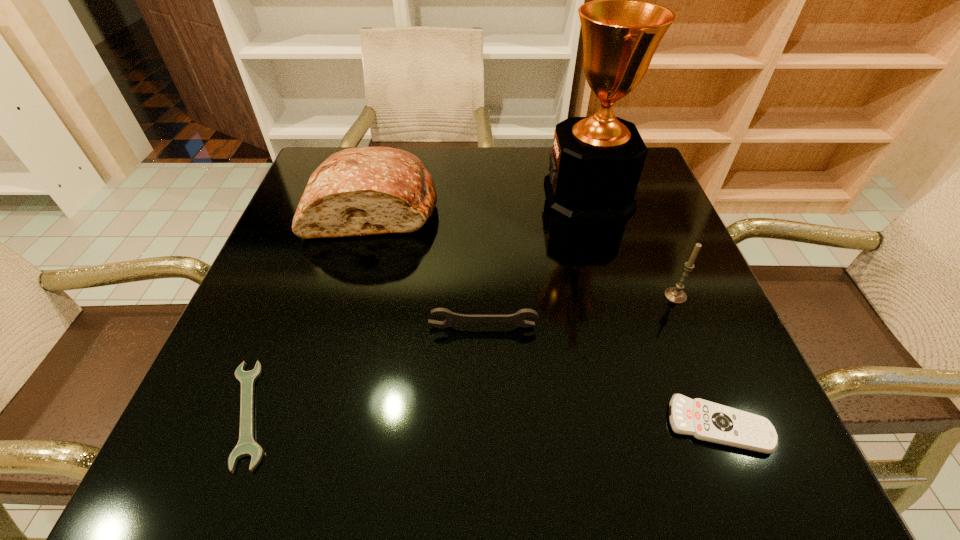
The image size is (960, 540). I want to click on vacant space at the left edge of the desktop, so click(294, 256).

Find the location of a particular element. The width and height of the screenshot is (960, 540). vacant space at the right edge of the desktop is located at coordinates (695, 355).

Locate an element on the screen. The image size is (960, 540). vacant region at the near left corner is located at coordinates (257, 466).

Where is `empty location between the bread and the third shortest object`? This screenshot has height=540, width=960. empty location between the bread and the third shortest object is located at coordinates (428, 266).

Identify the location of empty space between the remote control and the candle. (697, 361).

Where is `free spot between the tallest object and the remote control`? free spot between the tallest object and the remote control is located at coordinates (654, 310).

The image size is (960, 540). Identify the location of free space that is in between the third nearest object and the tallest object. (536, 261).

Where is `free space between the left wrench and the farther wrench`? free space between the left wrench and the farther wrench is located at coordinates (366, 370).

At what (x,y) coordinates should I click in order to perform the action: click on unoccupied position between the fourth tallest object and the second shortest object. Please return your answer as a coordinate pair (x, y). Looking at the image, I should click on pyautogui.click(x=601, y=376).

Identify the location of empty space that is in between the nearer wrench and the bread. This screenshot has height=540, width=960. (311, 309).